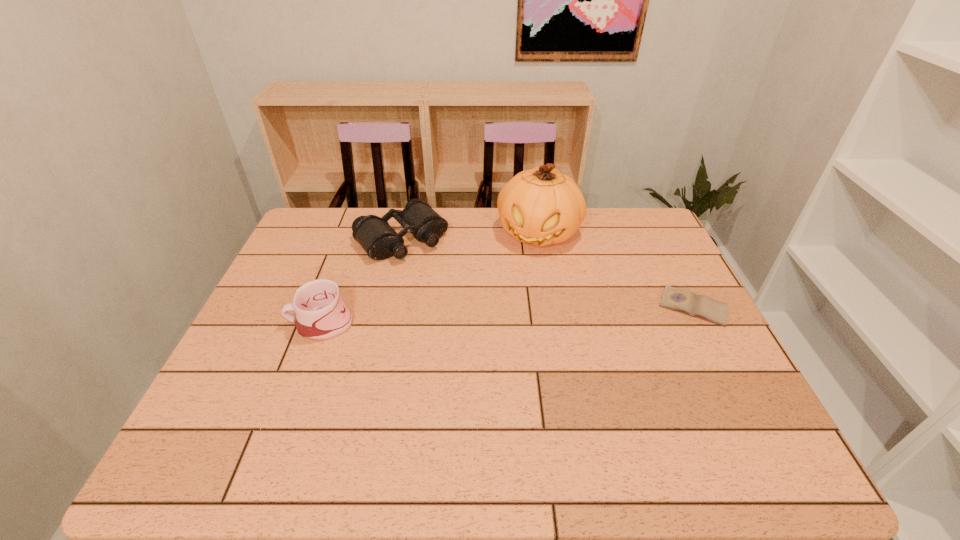
Find the location of a particular element. This screenshot has height=540, width=960. mug is located at coordinates (321, 314).

The image size is (960, 540). What are the coordinates of `the shortest object` in the screenshot? It's located at (686, 301).

Locate an element on the screen. Image resolution: width=960 pixels, height=540 pixels. the rightmost object is located at coordinates (686, 301).

Where is `binoculars`? The height and width of the screenshot is (540, 960). binoculars is located at coordinates (380, 241).

Locate an element on the screen. The image size is (960, 540). the second object from right to left is located at coordinates (540, 206).

Find the location of a particular element. This screenshot has height=540, width=960. pumpkin is located at coordinates (540, 206).

Find the location of `vacant space located on the front of the diary`. vacant space located on the front of the diary is located at coordinates (721, 361).

At what (x,y) coordinates should I click in order to perform the action: click on vacant space located 0.250m through the eyepieces of the binoculars. Please return your answer as a coordinate pair (x, y). Looking at the image, I should click on 469,310.

Locate an element on the screen. This screenshot has width=960, height=540. vacant space located 0.260m through the eyepieces of the binoculars is located at coordinates (472, 312).

The image size is (960, 540). What are the coordinates of `vacant space located through the eyepieces of the binoculars` in the screenshot? It's located at (487, 328).